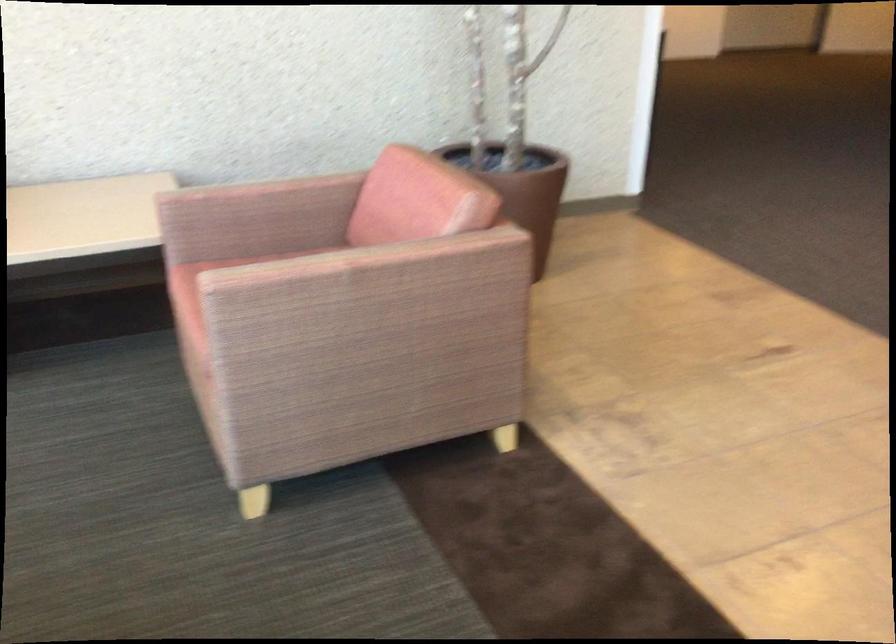
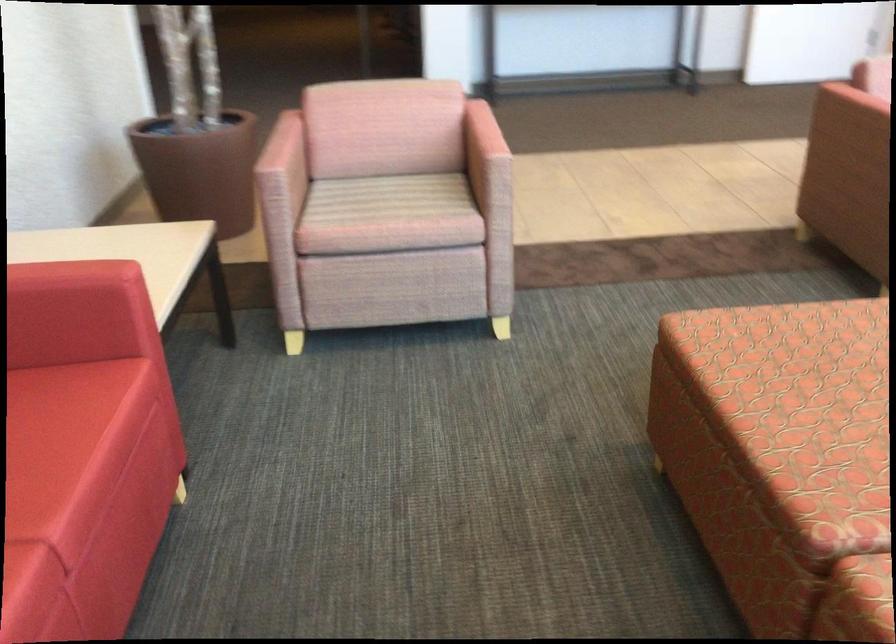
Locate, in the second image, the point that corresponds to [302,263] in the first image.

(481, 133)